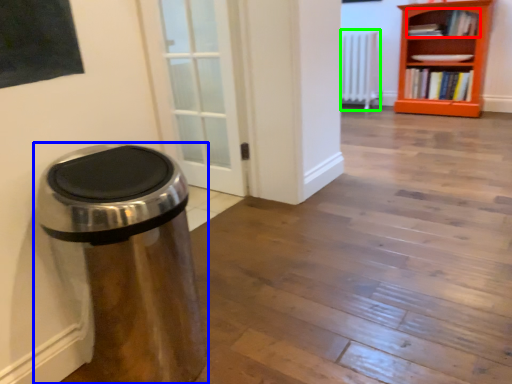
Question: Which object is positioned closest to book (highlighted by a red box)? Select from waste container (highlighted by a blue box) and radiator (highlighted by a green box).

Choices:
 (A) waste container
 (B) radiator

Answer: (B)